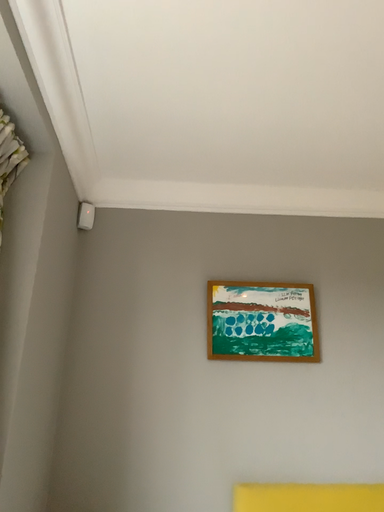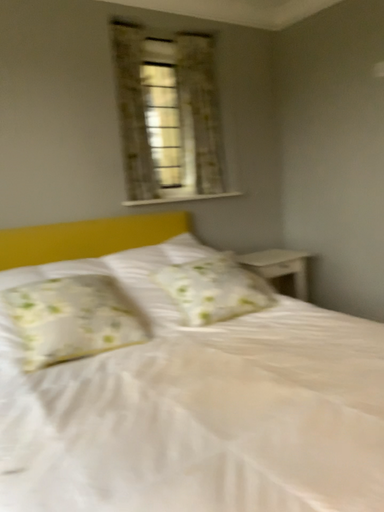
Question: Which way did the camera rotate in the video?

Choices:
 (A) rotated left
 (B) rotated right

Answer: (B)